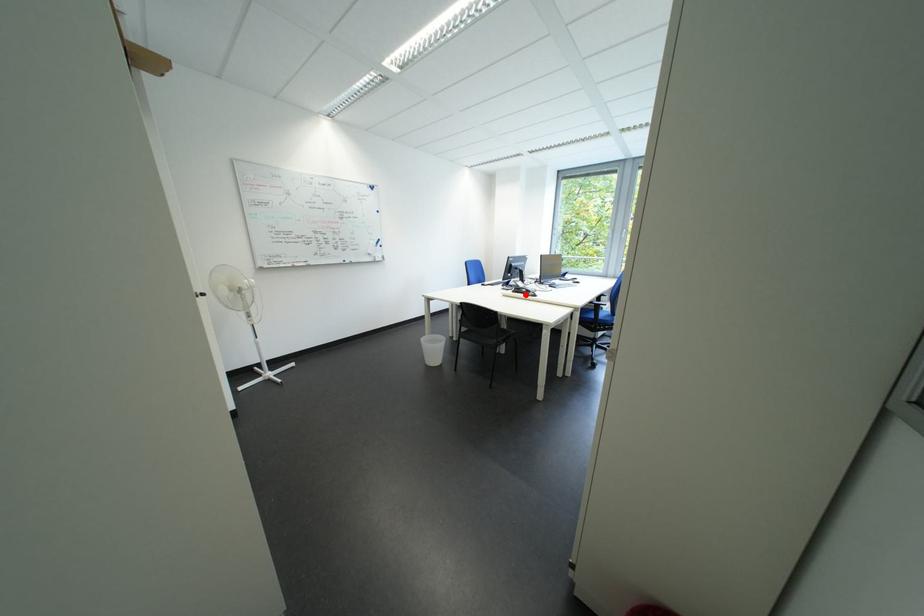
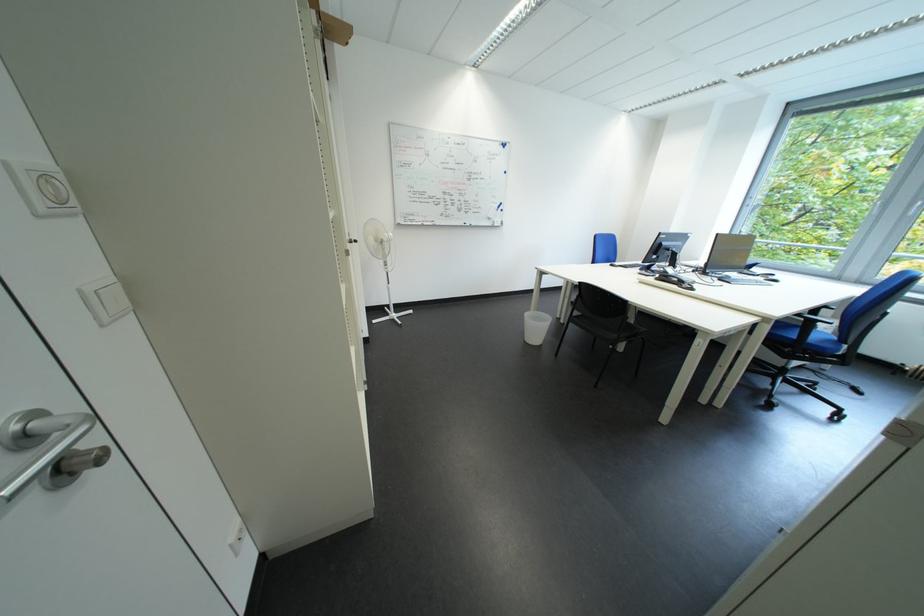
Question: A red point is marked in image1. In image2, is the corresponding 3D point closer to the camera or farther? Reply with the corresponding letter.

Choices:
 (A) The corresponding 3D point is closer.
 (B) The corresponding 3D point is farther.

Answer: (A)